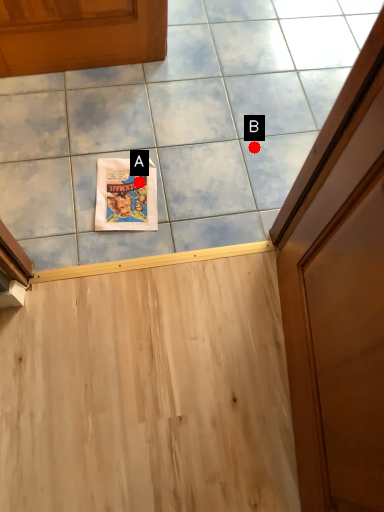
Question: Two points are circled on the image, labeled by A and B beside each circle. Which point is farther to the camera?

Choices:
 (A) A is further
 (B) B is further

Answer: (B)